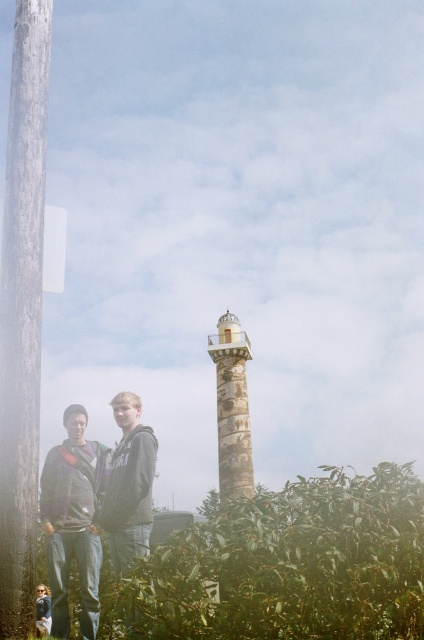
You are standing in the scene and want to move from the wooden telegraph pole at left to the matte gray hoodie at lower left. Which direction should you move?

You should move to the right because the wooden telegraph pole at left is to the left of the matte gray hoodie at lower left.